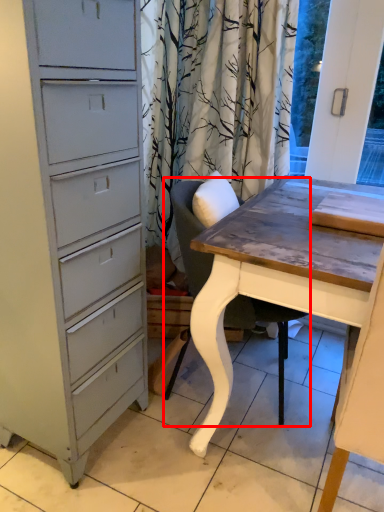
Question: In this image, where is chair (annotated by the red box) located relative to table?

Choices:
 (A) left
 (B) right

Answer: (A)